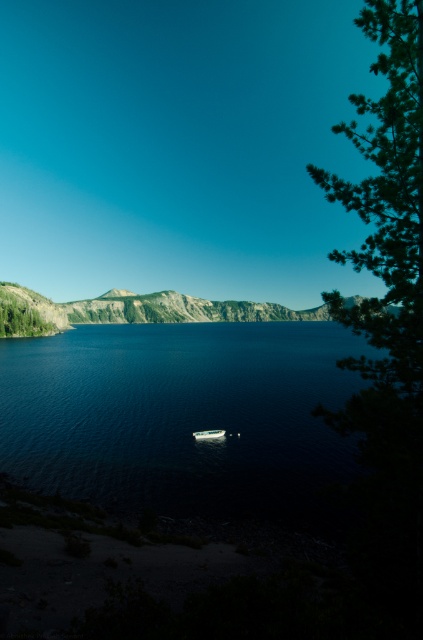
Question: Can you confirm if green leafy tree at right is wider than white plastic boat at center?

Choices:
 (A) yes
 (B) no

Answer: (A)

Question: Can you confirm if green matte tree at left is positioned below white plastic boat at center?

Choices:
 (A) no
 (B) yes

Answer: (A)

Question: Considering the real-world distances, which object is closest to the green leafy tree at right?

Choices:
 (A) deep blue water at center
 (B) green matte tree at left
 (C) white plastic boat at center

Answer: (C)

Question: Which point is farther to the camera?

Choices:
 (A) (384, 390)
 (B) (11, 307)
 (C) (332, 326)

Answer: (C)

Question: Which object appears closest to the camera in this image?

Choices:
 (A) deep blue water at center
 (B) green leafy tree at right
 (C) green matte tree at left
 (D) white plastic boat at center

Answer: (B)

Question: Can you confirm if deep blue water at center is positioned above green matte tree at left?

Choices:
 (A) no
 (B) yes

Answer: (A)